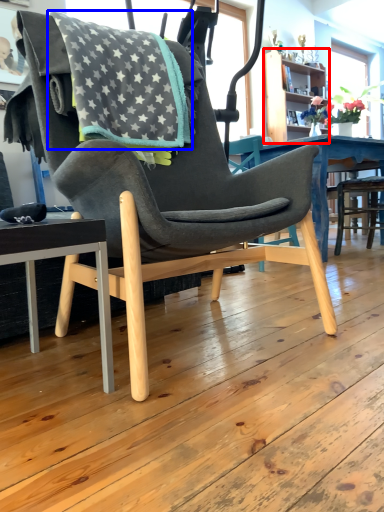
Question: Which object appears closest to the camera in this image, bookshelf (highlighted by a red box) or blanket (highlighted by a blue box)?

Choices:
 (A) bookshelf
 (B) blanket

Answer: (B)